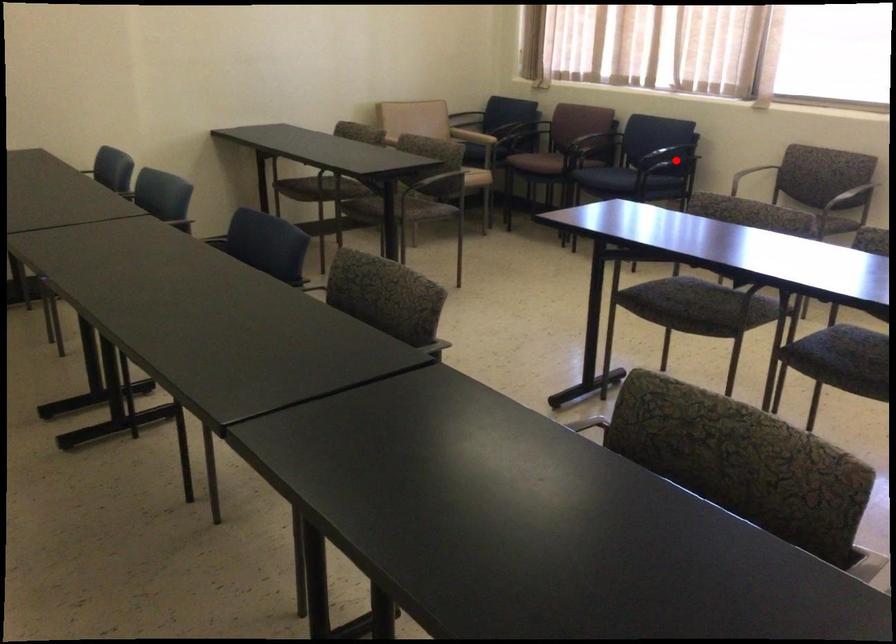
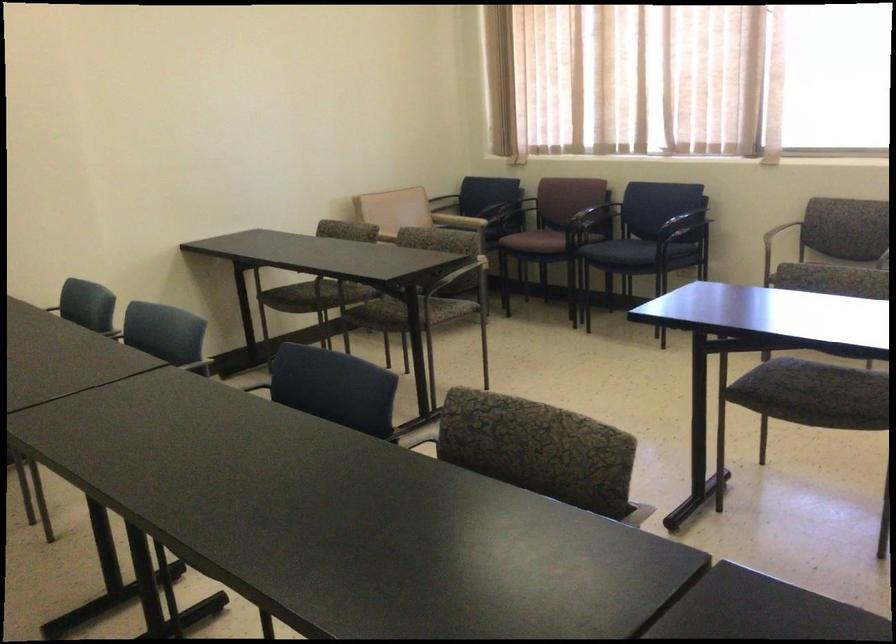
Where in the second image is the point corresponding to the highlighted location from the first image?

(687, 225)